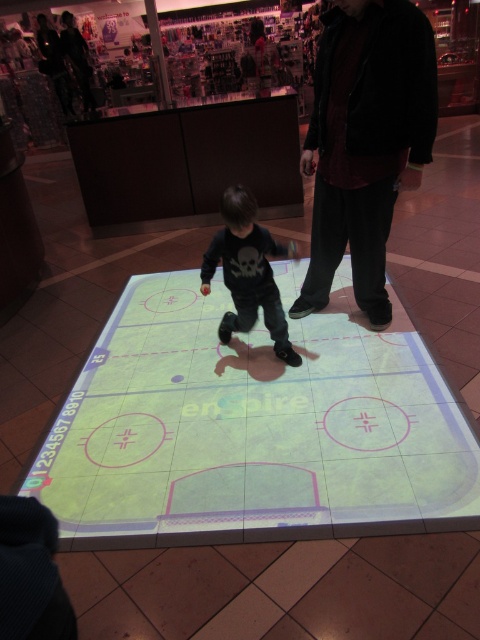
Question: In this image, where is green matte hockey rink at center located relative to dark red fabric jacket at center?

Choices:
 (A) above
 (B) below

Answer: (B)

Question: Can you confirm if green matte hockey rink at center is positioned below black matte shirt at center?

Choices:
 (A) no
 (B) yes

Answer: (B)

Question: Which point is farther to the camera?

Choices:
 (A) green matte hockey rink at center
 (B) dark red fabric jacket at center

Answer: (B)

Question: Which of these objects is positioned farthest from the dark red fabric jacket at center?

Choices:
 (A) black matte shirt at center
 (B) green matte hockey rink at center

Answer: (B)

Question: Is green matte hockey rink at center positioned at the back of dark red fabric jacket at center?

Choices:
 (A) no
 (B) yes

Answer: (A)

Question: Among these points, which one is farthest from the camera?

Choices:
 (A) (54, 436)
 (B) (262, 250)

Answer: (B)